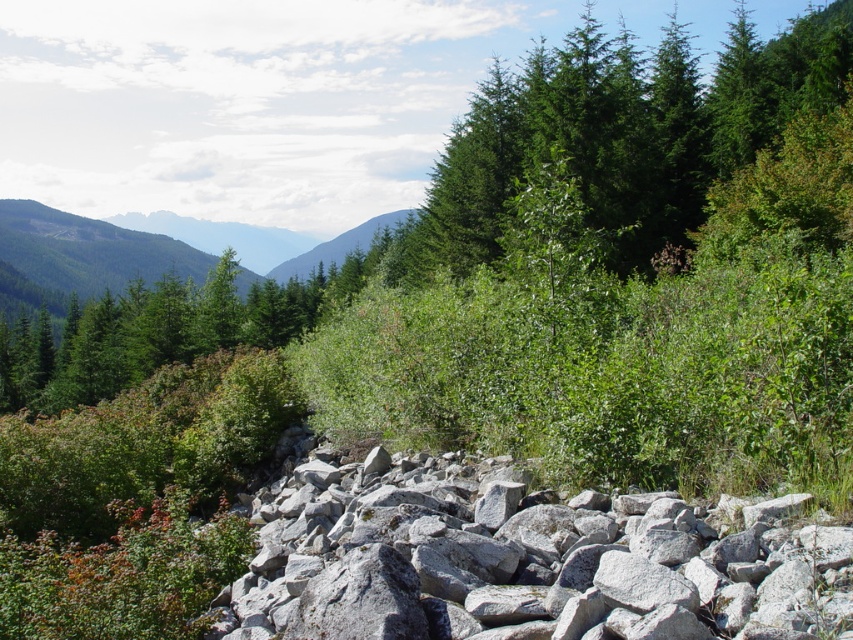
Question: Is gray/rough rock at center below green forested mountain at upper left?

Choices:
 (A) yes
 (B) no

Answer: (A)

Question: Which point is closer to the camera taking this photo?

Choices:
 (A) (740, 524)
 (B) (618, 35)
 (C) (122, 260)

Answer: (A)

Question: Does green glossy tree at upper right have a larger size compared to green forested mountain at upper left?

Choices:
 (A) no
 (B) yes

Answer: (B)

Question: From the image, what is the correct spatial relationship of green glossy tree at upper right in relation to green forested mountain at upper left?

Choices:
 (A) right
 (B) left

Answer: (A)

Question: Which object is positioned farthest from the green forested mountain at upper left?

Choices:
 (A) gray/rough rock at center
 (B) green glossy tree at upper right

Answer: (A)

Question: Which object is positioned closest to the green glossy tree at upper right?

Choices:
 (A) green forested mountain at upper left
 (B) gray/rough rock at center

Answer: (B)